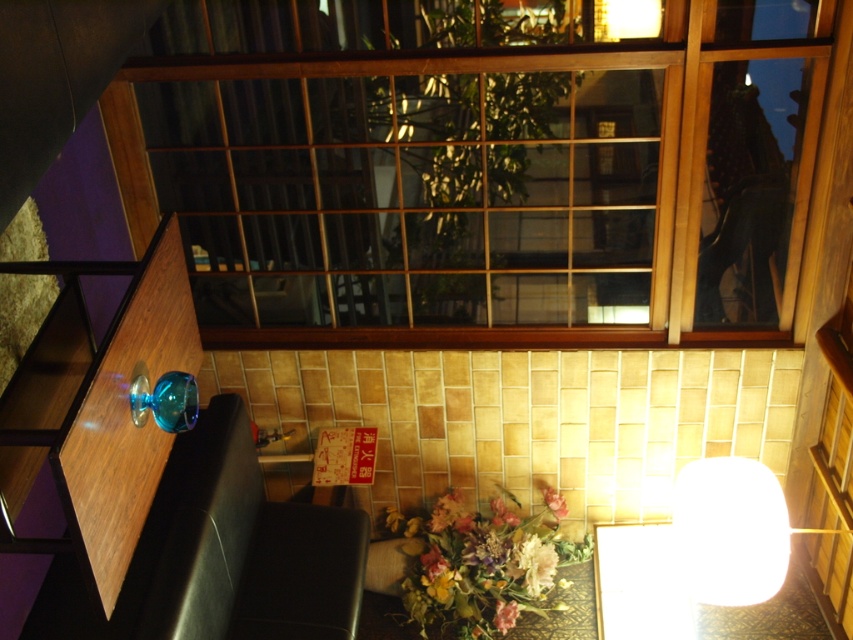
You are sitting at the black leather booth and want to reach both the point at coordinates point (496, 556) and point (440, 513) on the table. Which point is closer to you?

Point (496, 556) is in front of point (440, 513), so it is closer to you.

You are a customer sitting at the table and want to reach both the pastel floral bouquet at center and the pastel floral arrangement at lower center. Which one is closer to your right hand?

The pastel floral bouquet at center is positioned on the right side of the pastel floral arrangement at lower center, so the bouquet is closer to your right hand.